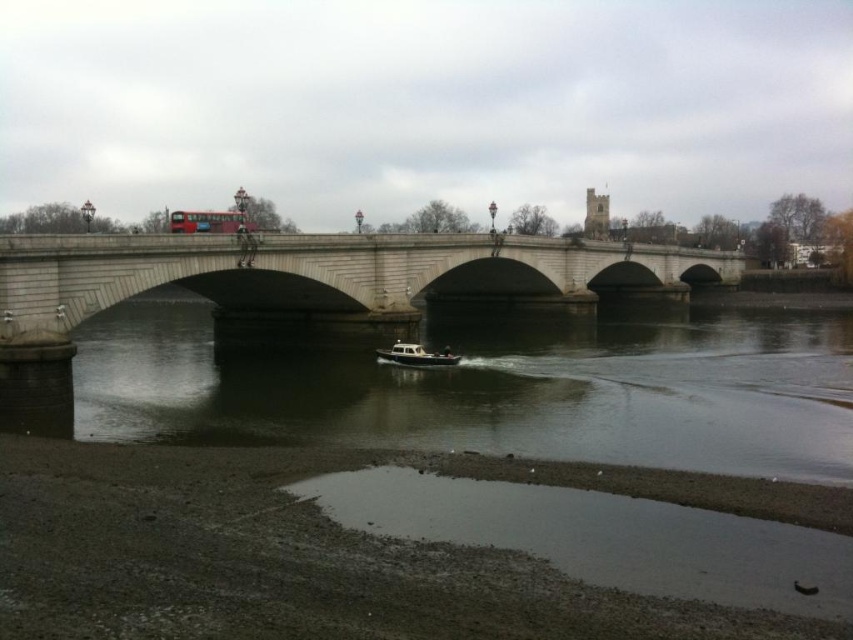
Question: From the image, what is the correct spatial relationship of red metallic bus at center in relation to white matte boat at center?

Choices:
 (A) right
 (B) left

Answer: (B)

Question: Can you confirm if stone bridge at center is positioned below red metallic bus at center?

Choices:
 (A) no
 (B) yes

Answer: (B)

Question: Among these objects, which one is farthest from the camera?

Choices:
 (A) white matte boat at center
 (B) red metallic bus at center
 (C) stone bridge at center

Answer: (B)

Question: Which of the following is the farthest from the observer?

Choices:
 (A) stone bridge at center
 (B) red metallic bus at center

Answer: (B)

Question: Is stone bridge at center in front of white matte boat at center?

Choices:
 (A) yes
 (B) no

Answer: (A)

Question: Considering the real-world distances, which object is closest to the white matte boat at center?

Choices:
 (A) red metallic bus at center
 (B) stone bridge at center

Answer: (A)